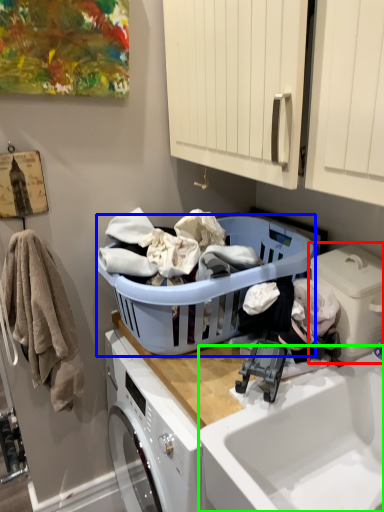
Question: Which is farther away from washing machine (highlighted by a red box)? laundry basket (highlighted by a blue box) or sink (highlighted by a green box)?

Choices:
 (A) laundry basket
 (B) sink

Answer: (A)